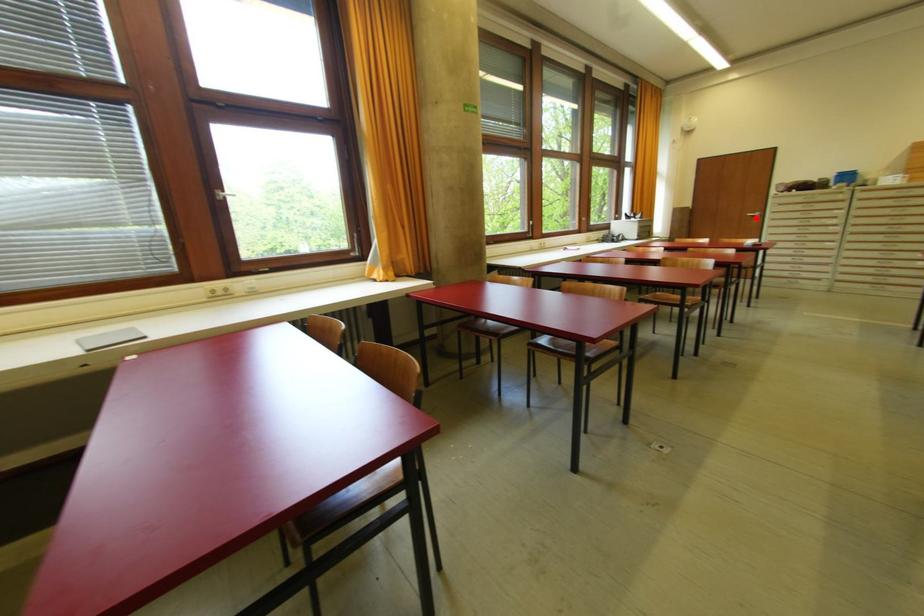
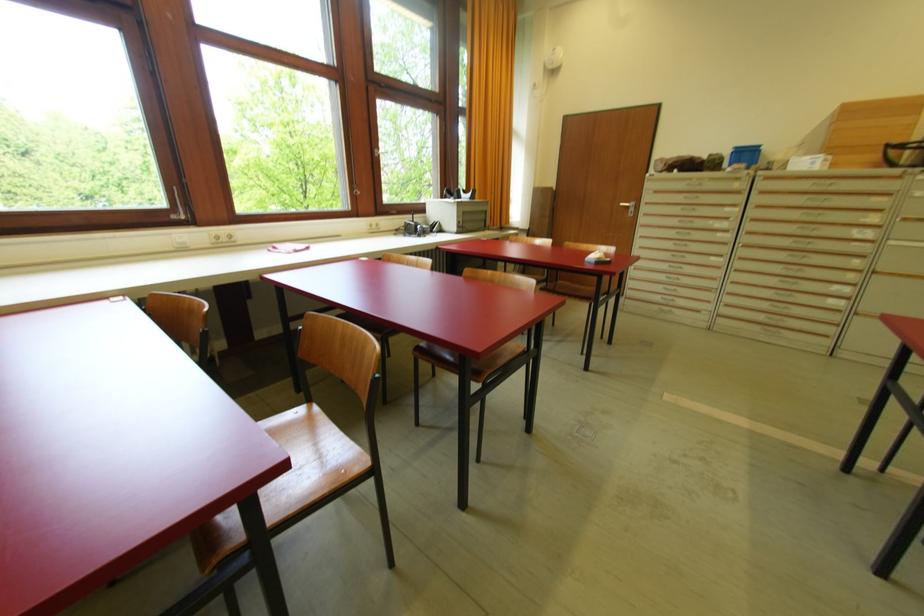
Find the pixel in the second image that matches the highlighted location in the first image.

(629, 209)